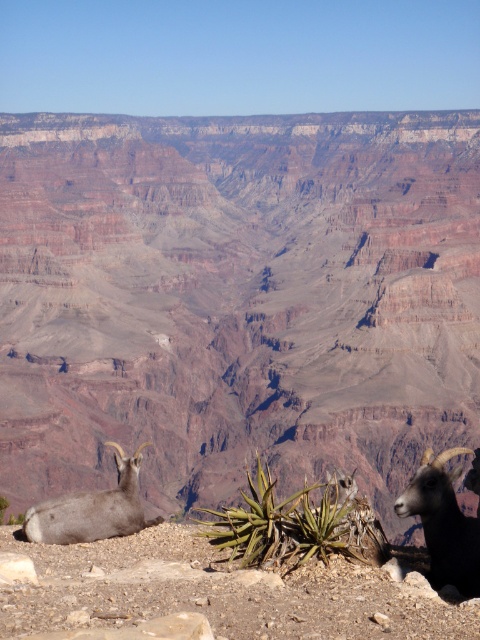
You are a hiker who wants to take a photo of the black woolly goat at lower right and the gray woolen goat at lower left. Which goat should you focus on first if you want to capture both in the frame without moving your camera?

You should focus on the black woolly goat at lower right first because it is larger and will require more space in the frame to capture its full size while still including the gray woolen goat at lower left.

You are a hiker standing at the edge of the Grand Canyon and see the gray woolen goat at lower left and the gray rocky hillside at lower center. Which object is closer to you?

The gray rocky hillside at lower center is closer to you because the gray woolen goat at lower left is behind it.

You are standing at the edge of the Grand Canyon and see two points marked in the image. The first point is at coordinate point (470,544) and the second is at point (139,449). Which point is closer to you?

Point (470,544) is closer to the viewer than point (139,449).